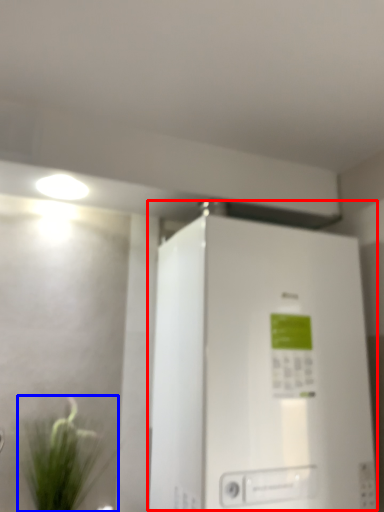
Question: Which point is closer to the camera, refrigerator (highlighted by a red box) or houseplant (highlighted by a blue box)?

Choices:
 (A) refrigerator
 (B) houseplant

Answer: (A)